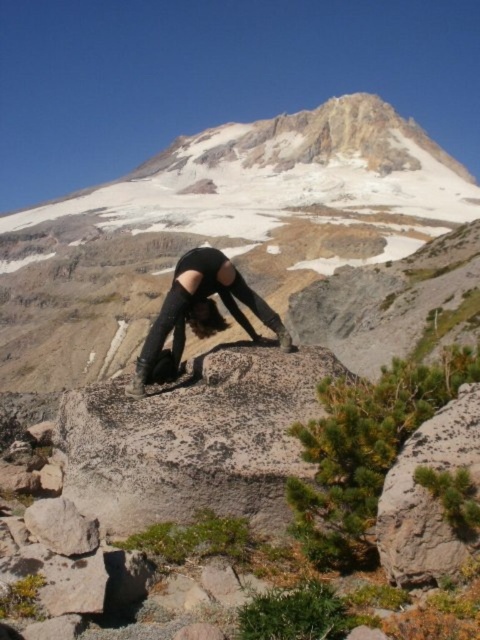
You are a photographer trying to capture the black leather boots at center and the gray rough rock at lower right in the same frame. Based on their positions, which object should you focus on first to ensure both are in sharp focus?

The gray rough rock at lower right is below the black leather boots at center, so you should focus on the black leather boots at center first since it is closer to the camera.

From the picture: You are a photographer planning to take a picture of the scene described. You want to ensure that the gray rough rock at lower right is positioned exactly at the center of the image. Given its current coordinates at point 0.775, 0.892, what adjustment should you make to the camera frame to center it?

To center the gray rough rock at lower right, you need to move the camera frame upwards and to the left since its current coordinates are at [428,496], which is closer to the lower right corner. Adjusting the frame upwards decreases the y coordinate and moving left decreases the x coordinate, bringing it to the center point.